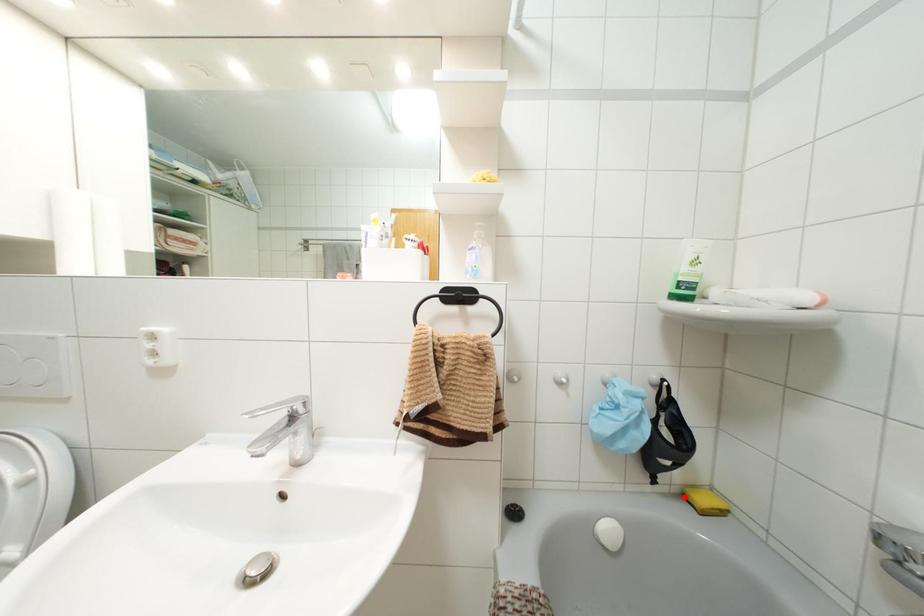
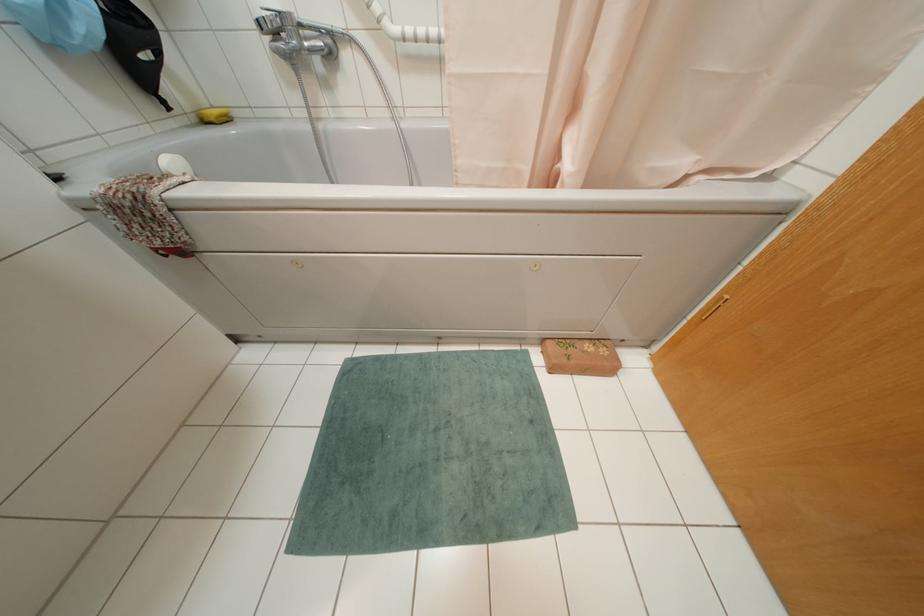
Find the pixel in the second image that matches the highlighted location in the first image.

(202, 121)